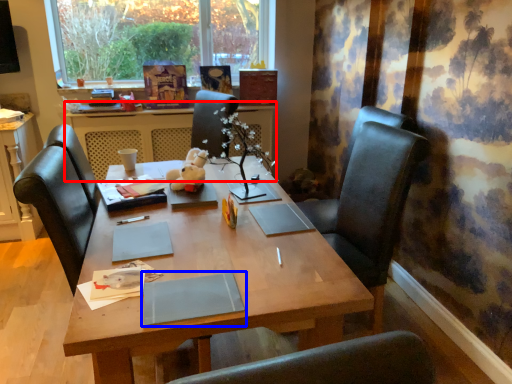
Question: Among these objects, which one is farthest to the camera, table (highlighted by a red box) or notebook (highlighted by a blue box)?

Choices:
 (A) table
 (B) notebook

Answer: (A)